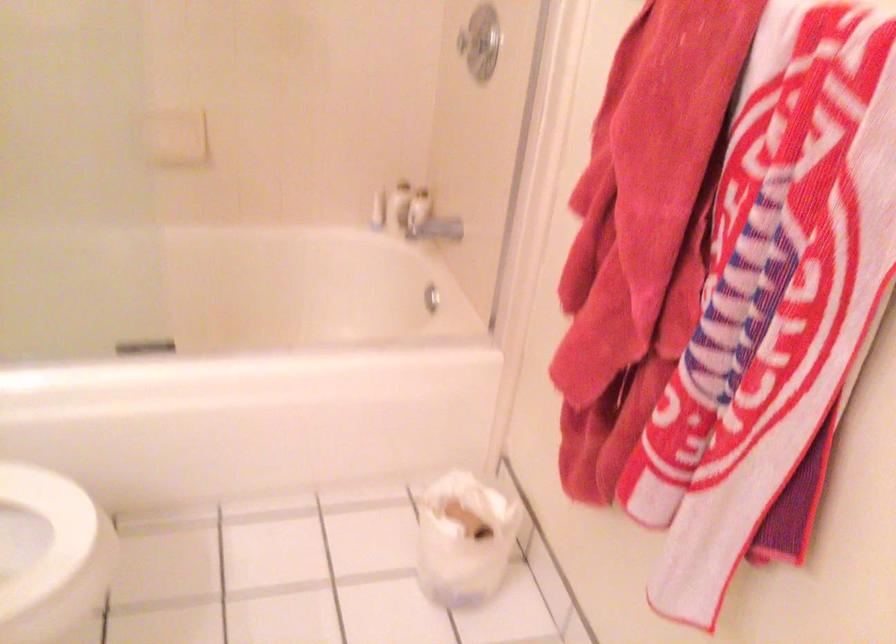
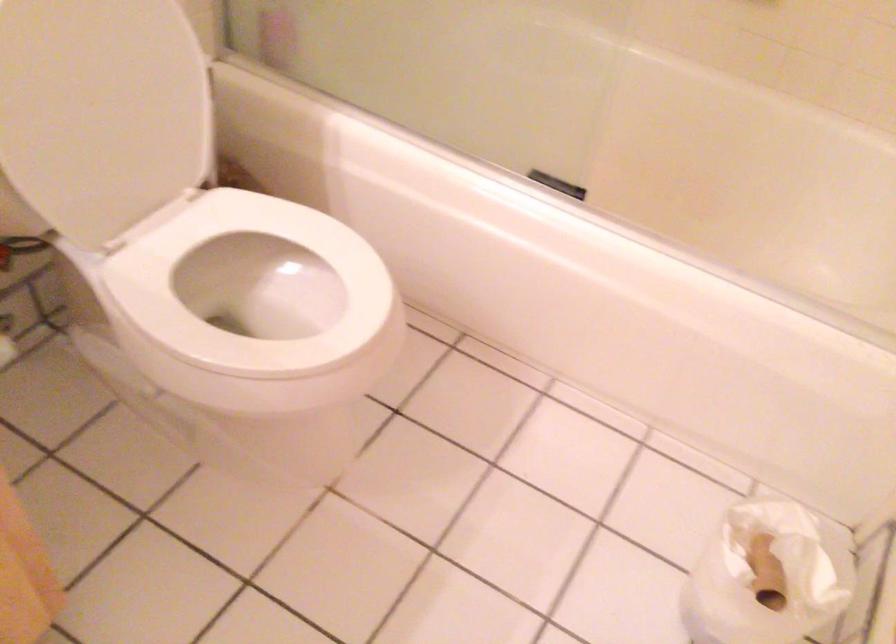
In the scene shown: The images are taken continuously from a first-person perspective. In which direction is your viewpoint rotating?

The camera's rotation is toward left-down.